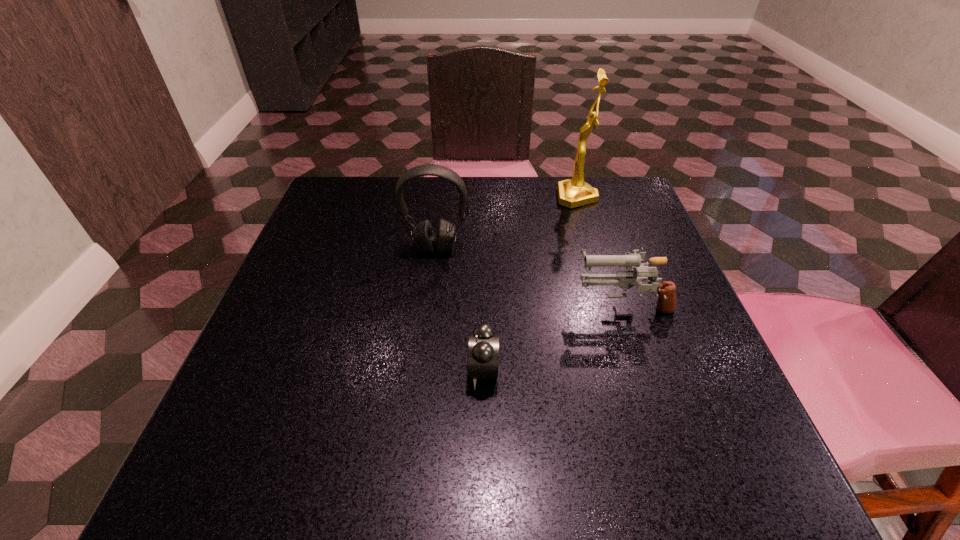
Where is `object that is the closest to the gun`? Image resolution: width=960 pixels, height=540 pixels. object that is the closest to the gun is located at coordinates (483, 343).

Find the location of a particular element. The image size is (960, 540). vacant space that satisfies the following two spatial constraints: 1. on the front-facing side of the award; 2. on the front-facing side of the second farthest object is located at coordinates (591, 247).